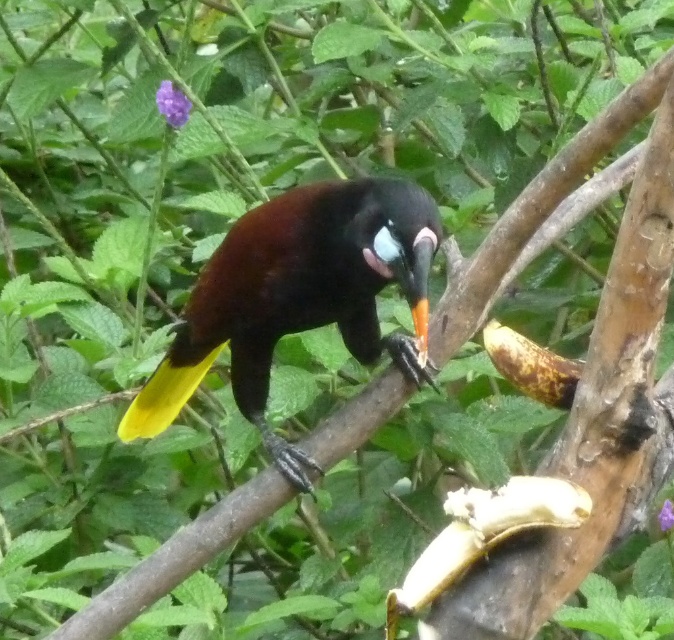
Question: Which point is closer to the camera taking this photo?

Choices:
 (A) (489, 492)
 (B) (559, 390)

Answer: (A)

Question: Considering the relative positions of shiny black bird at center and yellowish-brown textured banana at right in the image provided, where is shiny black bird at center located with respect to yellowish-brown textured banana at right?

Choices:
 (A) below
 (B) above

Answer: (A)

Question: Which point appears closest to the camera in this image?

Choices:
 (A) (460, 508)
 (B) (570, 387)

Answer: (A)

Question: Does yellow matte banana at lower right have a smaller size compared to yellowish-brown textured banana at right?

Choices:
 (A) no
 (B) yes

Answer: (A)

Question: Can you confirm if shiny black bird at center is positioned to the left of yellow matte banana at lower right?

Choices:
 (A) yes
 (B) no

Answer: (A)

Question: Which point is closer to the camera taking this photo?

Choices:
 (A) (549, 356)
 (B) (417, 211)
 (C) (425, 568)

Answer: (C)